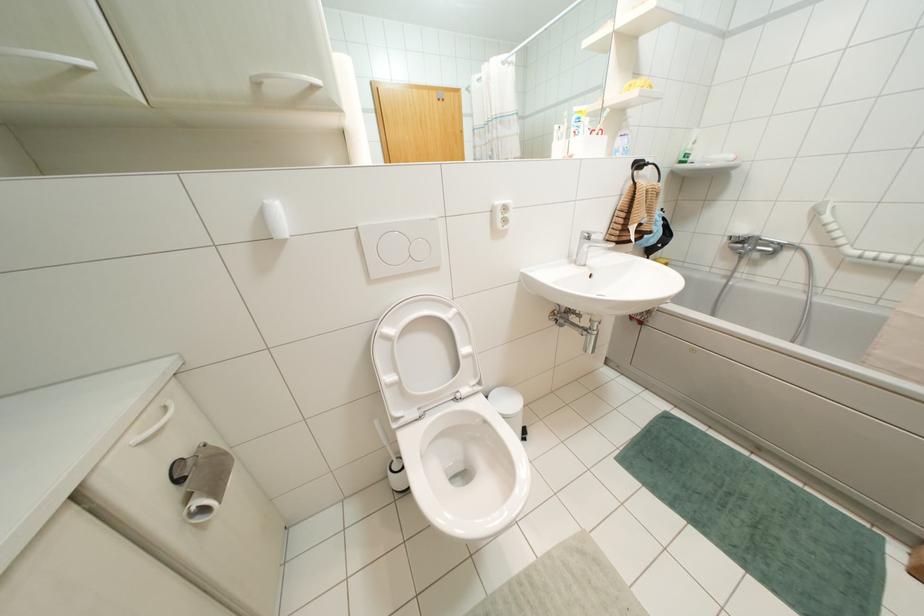
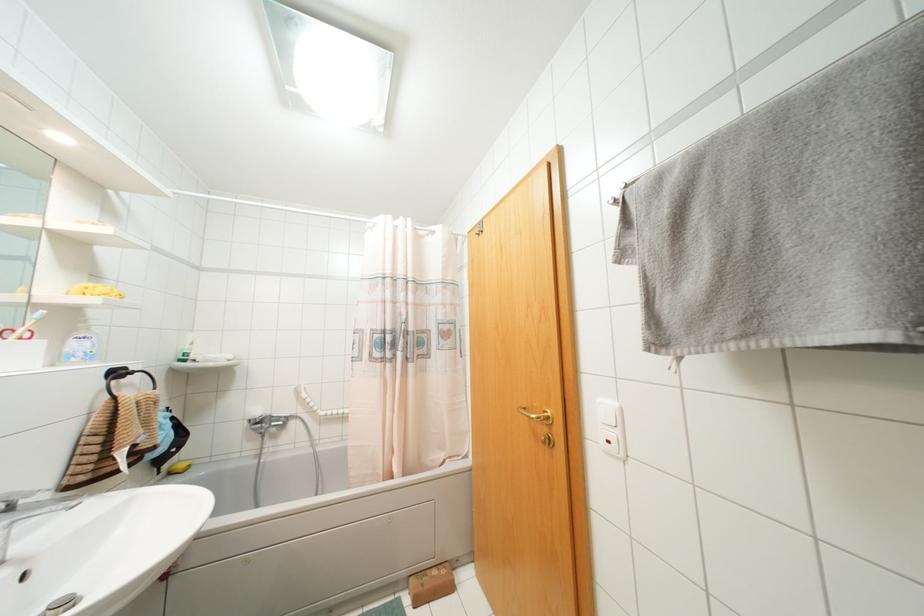
The point at (594, 233) is marked in the first image. Where is the corresponding point in the second image?

(30, 493)